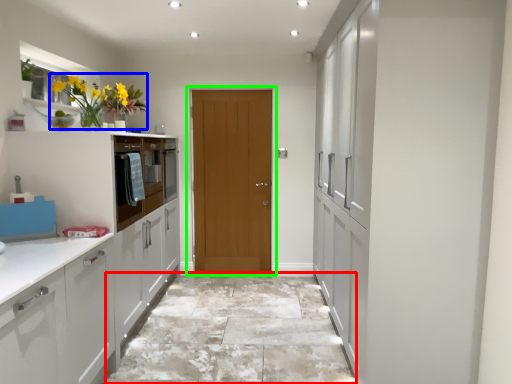
Question: Which object is the farthest from granite (highlighted by a red box)? Choose among these: floral arrangement (highlighted by a blue box) or door (highlighted by a green box).

Choices:
 (A) floral arrangement
 (B) door

Answer: (A)